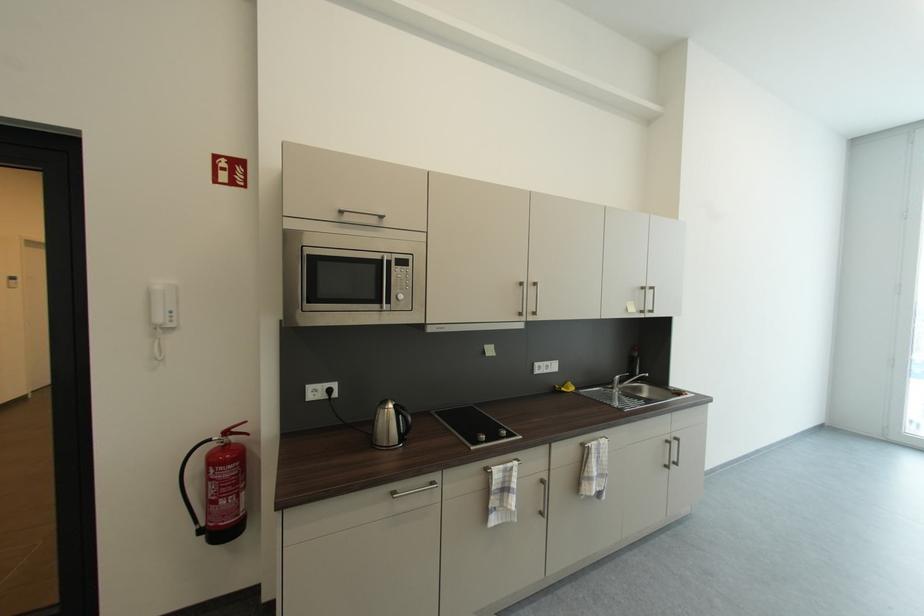
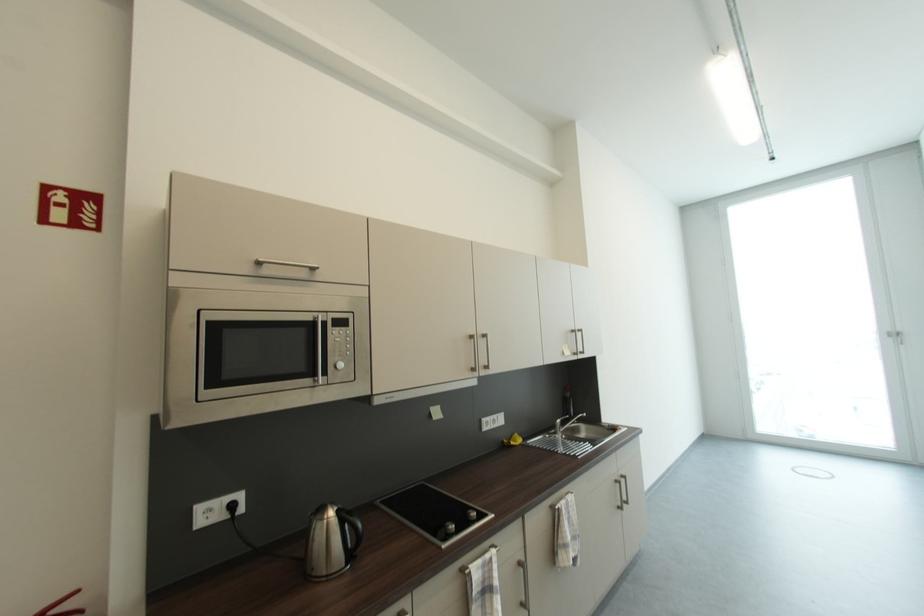
Question: The images are taken continuously from a first-person perspective. In which direction is your viewpoint rotating?

Choices:
 (A) Left
 (B) Right
 (C) Up
 (D) Down

Answer: (B)